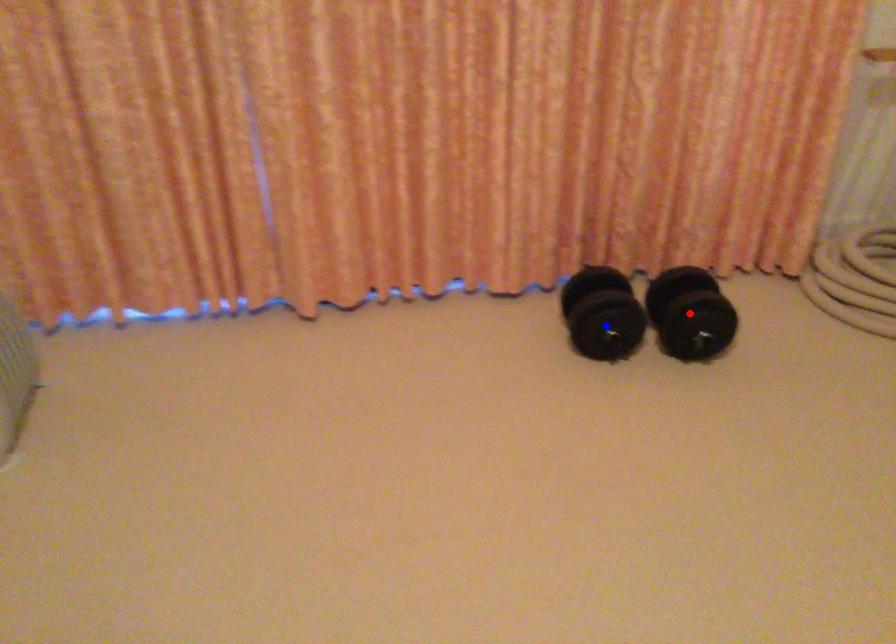
Question: In the image, two points are highlighted. Which point is nearer to the camera? Reply with the corresponding letter.

Choices:
 (A) blue point
 (B) red point

Answer: (B)